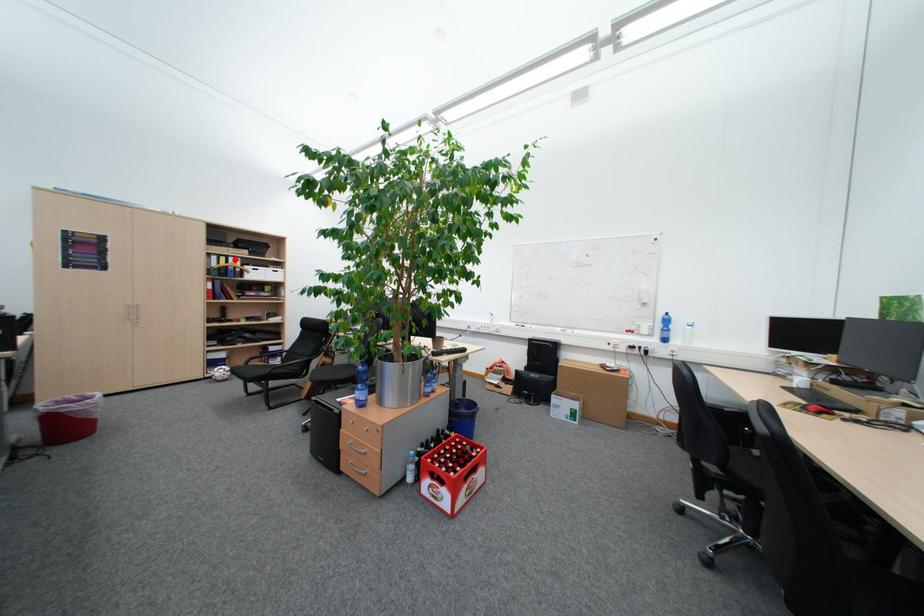
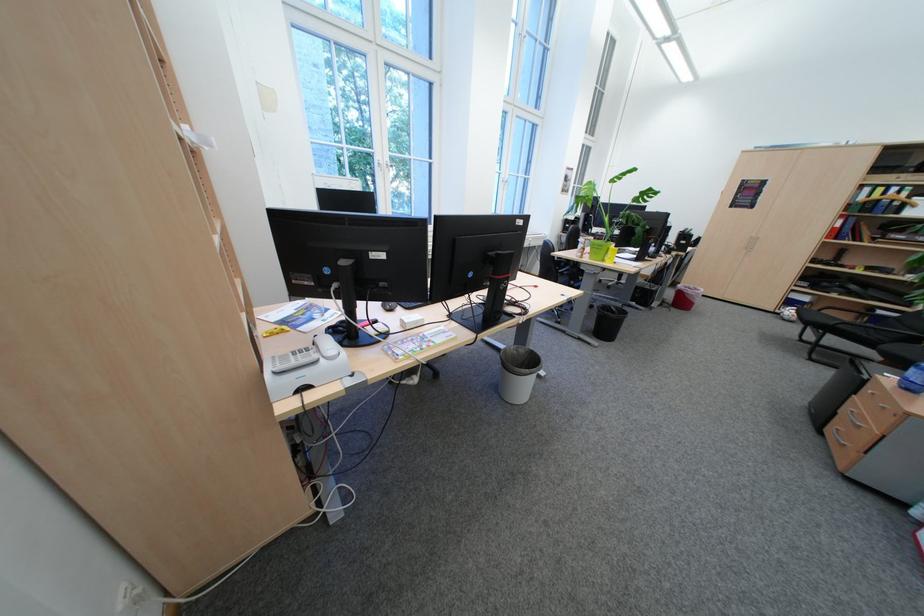
Locate, in the second image, the point that corresponds to the highlighted location in the first image.

(893, 190)